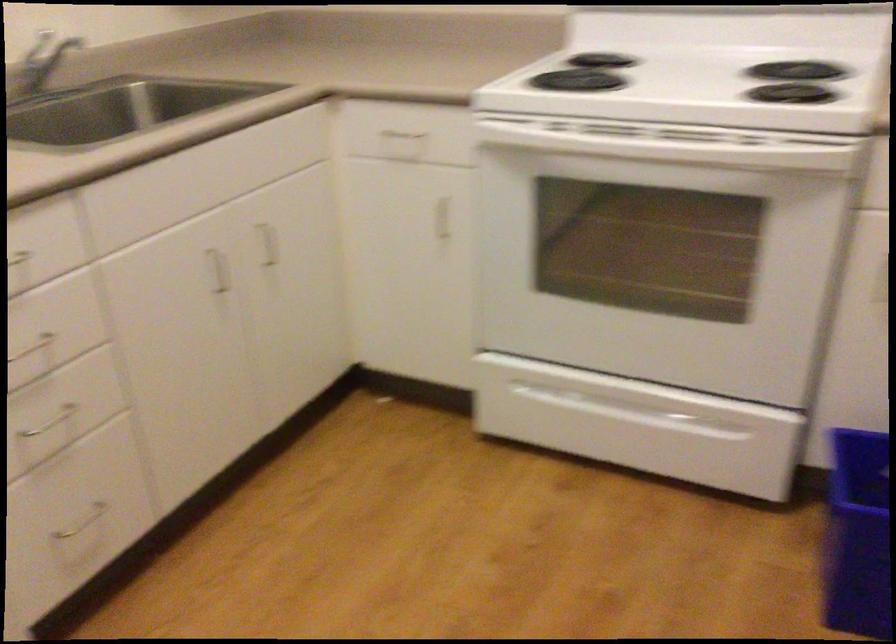
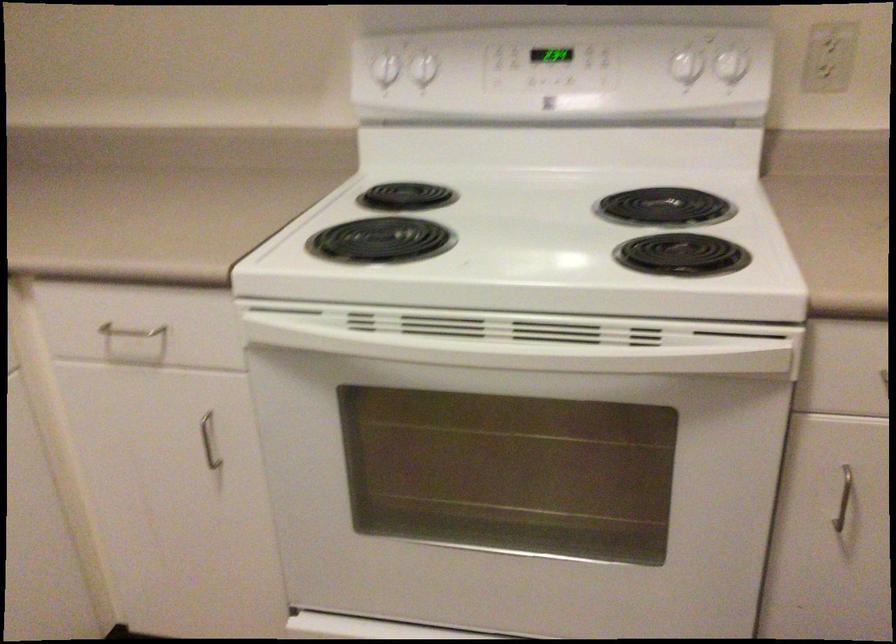
Find the pixel in the second image that matches point (440, 222) in the first image.

(209, 440)